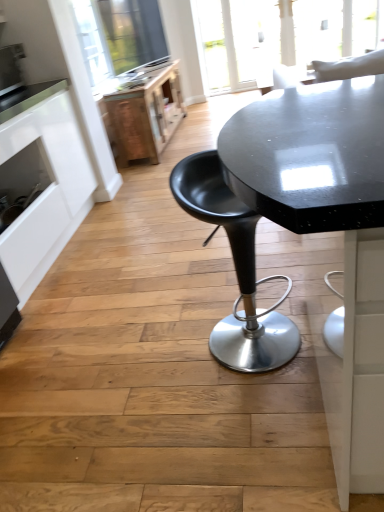
Question: Based on their sizes in the image, would you say wooden file cabinet at upper left is bigger or smaller than white matte cabinet at left?

Choices:
 (A) small
 (B) big

Answer: (A)

Question: Considering the positions of wooden file cabinet at upper left and white matte cabinet at left in the image, is wooden file cabinet at upper left taller or shorter than white matte cabinet at left?

Choices:
 (A) short
 (B) tall

Answer: (A)

Question: Based on their relative distances, which object is nearer to the wooden file cabinet at upper left?

Choices:
 (A) satin silver toaster at upper left
 (B) black plastic stool at center
 (C) white matte cabinet at left

Answer: (A)

Question: Which object is the closest to the black plastic stool at center?

Choices:
 (A) white matte cabinet at left
 (B) wooden file cabinet at upper left
 (C) satin silver toaster at upper left

Answer: (A)